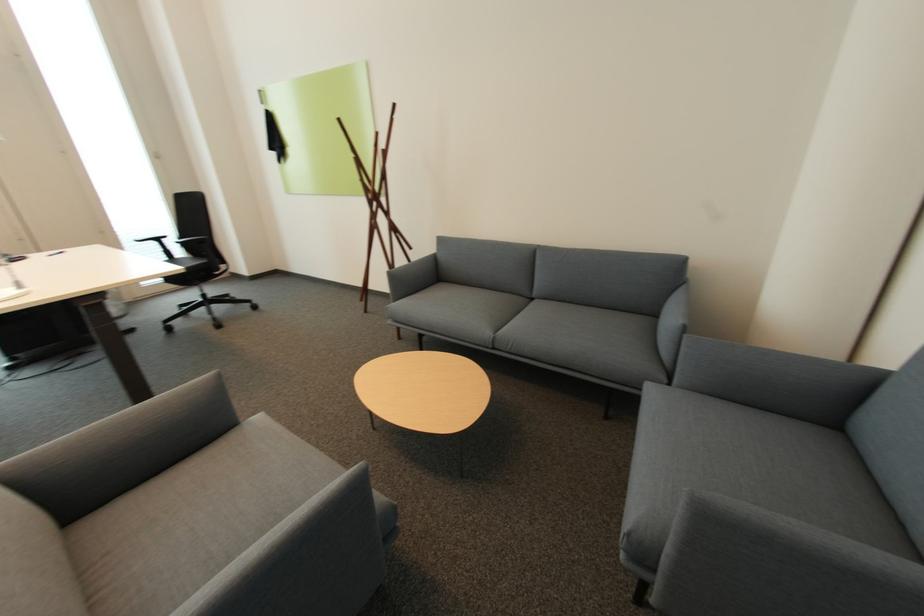
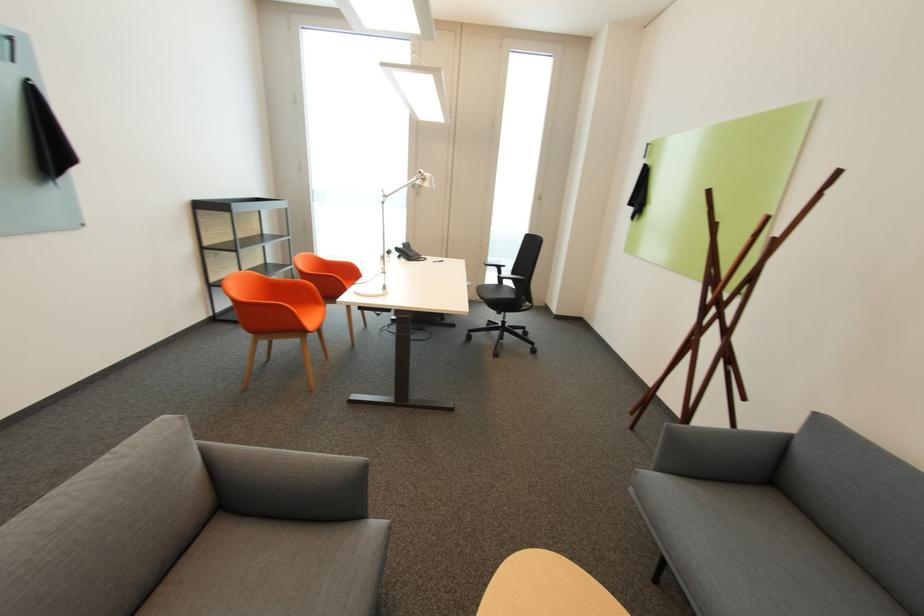
Locate, in the second image, the point that corresponds to (x=163, y=243) in the first image.

(503, 269)